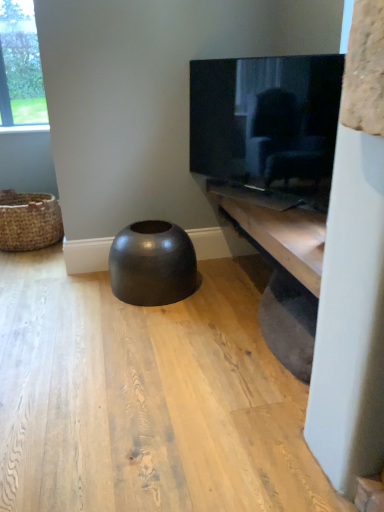
Image resolution: width=384 pixels, height=512 pixels. Describe the element at coordinates (153, 264) in the screenshot. I see `glossy black stool at center` at that location.

This screenshot has width=384, height=512. I want to click on glossy black stool at center, so click(x=153, y=264).

Where is `brown woven basket at left`? brown woven basket at left is located at coordinates (29, 221).

Image resolution: width=384 pixels, height=512 pixels. What do you see at coordinates (281, 266) in the screenshot? I see `wooden shelf at lower right` at bounding box center [281, 266].

Find the location of a particular element. Image resolution: width=384 pixels, height=512 pixels. matte black tv at upper right is located at coordinates (265, 117).

How different are the orientations of matte black tv at upper right and brown woven basket at left in degrees?

They differ by 65.9 degrees in their facing directions.

Is matte black tv at upper right at the left side of brown woven basket at left?

In fact, matte black tv at upper right is to the right of brown woven basket at left.

Does matte black tv at upper right have a greater height compared to brown woven basket at left?

Correct, matte black tv at upper right is much taller as brown woven basket at left.

Which of these two, matte black tv at upper right or brown woven basket at left, is wider?

With larger width is brown woven basket at left.

Which is behind, wooden shelf at lower right or glossy black stool at center?

glossy black stool at center is further away from the camera.

Does wooden shelf at lower right appear on the left side of glossy black stool at center?

In fact, wooden shelf at lower right is to the right of glossy black stool at center.

Between wooden shelf at lower right and glossy black stool at center, which one has more height?

glossy black stool at center.

Are brown woven basket at left and wooden shelf at lower right beside each other?

No, brown woven basket at left is not in contact with wooden shelf at lower right.

Considering the sizes of objects brown woven basket at left and wooden shelf at lower right in the image provided, who is wider, brown woven basket at left or wooden shelf at lower right?

With larger width is brown woven basket at left.

Is brown woven basket at left spatially inside wooden shelf at lower right, or outside of it?

brown woven basket at left is not inside wooden shelf at lower right, it's outside.

Is brown woven basket at left positioned with its back to wooden shelf at lower right?

No, brown woven basket at left's orientation is not away from wooden shelf at lower right.

Which is in front, wooden shelf at lower right or brown woven basket at left?

wooden shelf at lower right is closer to the camera.

Considering the relative sizes of wooden shelf at lower right and brown woven basket at left in the image provided, is wooden shelf at lower right smaller than brown woven basket at left?

No.

Would you say wooden shelf at lower right is inside or outside brown woven basket at left?

wooden shelf at lower right lies outside brown woven basket at left.

Considering the sizes of wooden shelf at lower right and brown woven basket at left in the image, is wooden shelf at lower right wider or thinner than brown woven basket at left?

Considering their sizes, wooden shelf at lower right looks slimmer than brown woven basket at left.

Measure the distance from matte black tv at upper right to wooden shelf at lower right.

matte black tv at upper right is 37.89 centimeters away from wooden shelf at lower right.

Which is behind, matte black tv at upper right or wooden shelf at lower right?

matte black tv at upper right is more distant.

Find the location of `shelf below the matte black tv at upper right (from a real-world perspective)`. shelf below the matte black tv at upper right (from a real-world perspective) is located at coordinates (281, 266).

Locate an element on the screen. This screenshot has width=384, height=512. television above the wooden shelf at lower right (from a real-world perspective) is located at coordinates (265, 117).

Which of these two, wooden shelf at lower right or matte black tv at upper right, stands shorter?

wooden shelf at lower right.

Does wooden shelf at lower right have a larger size compared to matte black tv at upper right?

Indeed, wooden shelf at lower right has a larger size compared to matte black tv at upper right.

Can you see wooden shelf at lower right touching matte black tv at upper right?

No.

From a real-world perspective, is glossy black stool at center over brown woven basket at left?

No, from a real-world perspective, glossy black stool at center is not above brown woven basket at left.

Which object is closer to the camera taking this photo, glossy black stool at center or brown woven basket at left?

glossy black stool at center is closer to the camera.

The height and width of the screenshot is (512, 384). I want to click on basket positioned vertically above the glossy black stool at center (from a real-world perspective), so click(x=29, y=221).

Measure the distance between glossy black stool at center and brown woven basket at left.

The distance of glossy black stool at center from brown woven basket at left is 3.42 feet.

At what (x,y) coordinates should I click in order to perform the action: click on television that is above the brown woven basket at left (from a real-world perspective). Please return your answer as a coordinate pair (x, y). This screenshot has width=384, height=512. Looking at the image, I should click on (265, 117).

At what (x,y) coordinates should I click in order to perform the action: click on shelf lying in front of the glossy black stool at center. Please return your answer as a coordinate pair (x, y). Looking at the image, I should click on (281, 266).

From the picture: Looking at the image, which one is located closer to glossy black stool at center, wooden shelf at lower right or brown woven basket at left?

wooden shelf at lower right.

Estimate the real-world distances between objects in this image. Which object is closer to brown woven basket at left, wooden shelf at lower right or glossy black stool at center?

glossy black stool at center is closer to brown woven basket at left.

Estimate the real-world distances between objects in this image. Which object is further from matte black tv at upper right, glossy black stool at center or brown woven basket at left?

brown woven basket at left is positioned further to the anchor matte black tv at upper right.

Which object lies nearer to the anchor point wooden shelf at lower right, brown woven basket at left or matte black tv at upper right?

matte black tv at upper right is positioned closer to the anchor wooden shelf at lower right.

Estimate the real-world distances between objects in this image. Which object is closer to brown woven basket at left, matte black tv at upper right or wooden shelf at lower right?

matte black tv at upper right is positioned closer to the anchor brown woven basket at left.

Looking at this image, when comparing their distances from glossy black stool at center, does wooden shelf at lower right or matte black tv at upper right seem closer?

wooden shelf at lower right lies closer to glossy black stool at center than the other object.

Consider the image. When comparing their distances from matte black tv at upper right, does wooden shelf at lower right or brown woven basket at left seem further?

The object further to matte black tv at upper right is brown woven basket at left.

Based on their spatial positions, is brown woven basket at left or wooden shelf at lower right closer to matte black tv at upper right?

wooden shelf at lower right lies closer to matte black tv at upper right than the other object.

At what (x,y) coordinates should I click in order to perform the action: click on television between wooden shelf at lower right and glossy black stool at center in the front-back direction. Please return your answer as a coordinate pair (x, y). This screenshot has height=512, width=384. Looking at the image, I should click on (265, 117).

Image resolution: width=384 pixels, height=512 pixels. Identify the location of television between brown woven basket at left and wooden shelf at lower right from left to right. (265, 117).

I want to click on stool located between brown woven basket at left and matte black tv at upper right in the left-right direction, so click(153, 264).

I want to click on stool located between brown woven basket at left and wooden shelf at lower right in the left-right direction, so click(153, 264).